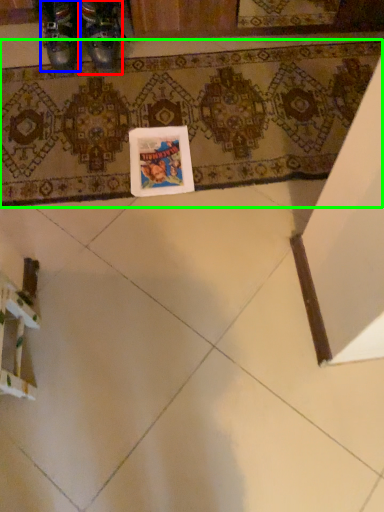
Question: Considering the real-world distances, which object is farthest from footwear (highlighted by a red box)? footwear (highlighted by a blue box) or bath mat (highlighted by a green box)?

Choices:
 (A) footwear
 (B) bath mat

Answer: (B)